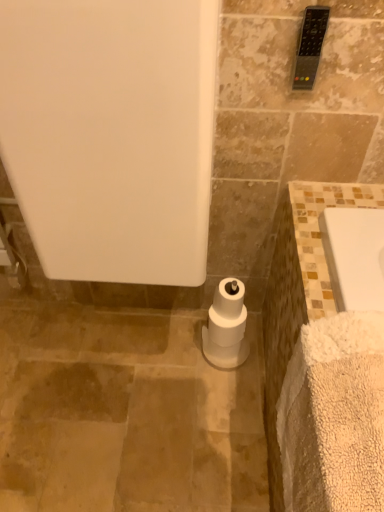
Where is `vacant region below white matte bathtub at center (from a real-world perspective)`? The width and height of the screenshot is (384, 512). vacant region below white matte bathtub at center (from a real-world perspective) is located at coordinates (148, 342).